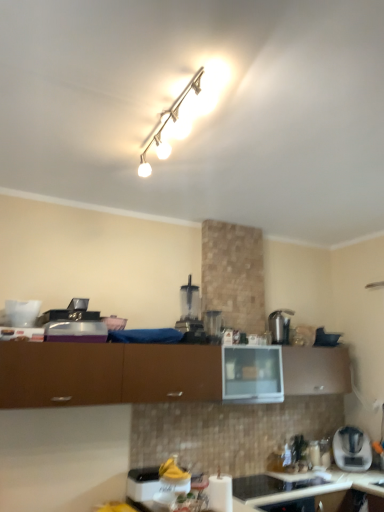
You are a GUI agent. You are given a task and a screenshot of the screen. Output one action in this format:
    pyautogui.click(x=<x>, y=<y>)
    Task: Click on the vacant area on top of white glossy track light at upper center (from a real-world perspective)
    The image size is (384, 512).
    Given the screenshot: What is the action you would take?
    click(183, 106)